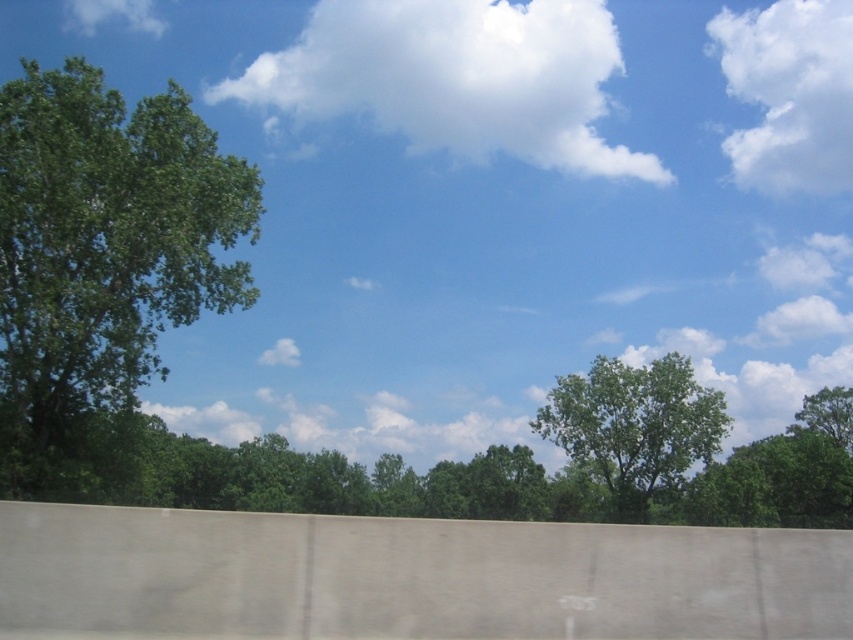
Is point (138, 8) behind point (815, 413)?

Yes, point (138, 8) is farther from viewer.

Is white fluffy cloud at upper left wider than green leafy tree at right?

In fact, white fluffy cloud at upper left might be narrower than green leafy tree at right.

Locate an element on the screen. This screenshot has height=640, width=853. white fluffy cloud at upper left is located at coordinates (111, 16).

This screenshot has width=853, height=640. What are the coordinates of `white fluffy cloud at upper left` in the screenshot? It's located at (111, 16).

Which of these two, green leafy tree at center or green leafy tree at right, stands taller?

green leafy tree at center

Is green leafy tree at center to the left of green leafy tree at right from the viewer's perspective?

Correct, you'll find green leafy tree at center to the left of green leafy tree at right.

At what (x,y) coordinates should I click in order to perform the action: click on green leafy tree at center. Please return your answer as a coordinate pair (x, y). Looking at the image, I should click on (634, 426).

Does green leafy tree at left have a lesser width compared to green leafy tree at center?

No.

Can you confirm if green leafy tree at left is positioned to the right of green leafy tree at center?

Incorrect, green leafy tree at left is not on the right side of green leafy tree at center.

This screenshot has width=853, height=640. Identify the location of green leafy tree at left. pyautogui.click(x=102, y=262).